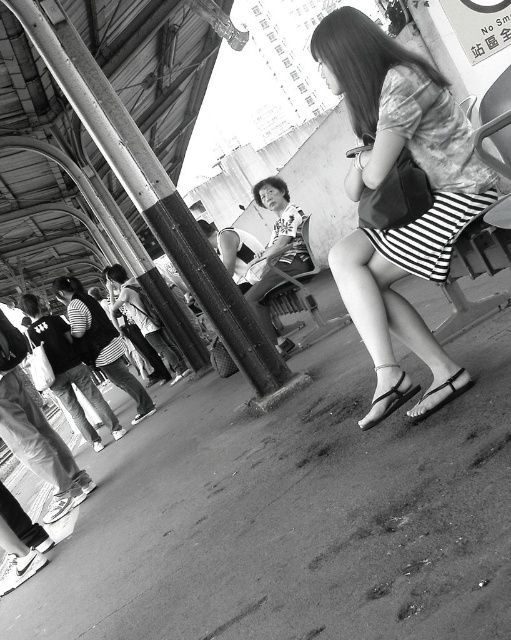
Question: Which object is farther from the camera taking this photo?

Choices:
 (A) black leather sandal at lower center
 (B) matte striped skirt at center
 (C) metallic silver sandal at lower center

Answer: (C)

Question: Is matte striped skirt at center behind black leather sandal at lower center?

Choices:
 (A) yes
 (B) no

Answer: (B)

Question: Is matte striped skirt at center below black leather sandal at lower center?

Choices:
 (A) yes
 (B) no

Answer: (B)

Question: Estimate the real-world distances between objects in this image. Which object is closer to the metallic silver sandal at lower center?

Choices:
 (A) matte striped skirt at center
 (B) black leather sandal at lower center

Answer: (B)

Question: Which of these objects is positioned closest to the metallic silver sandal at lower center?

Choices:
 (A) black leather sandal at lower center
 (B) matte striped skirt at center

Answer: (A)

Question: Does black leather sandal at lower center appear under metallic silver sandal at lower center?

Choices:
 (A) yes
 (B) no

Answer: (B)